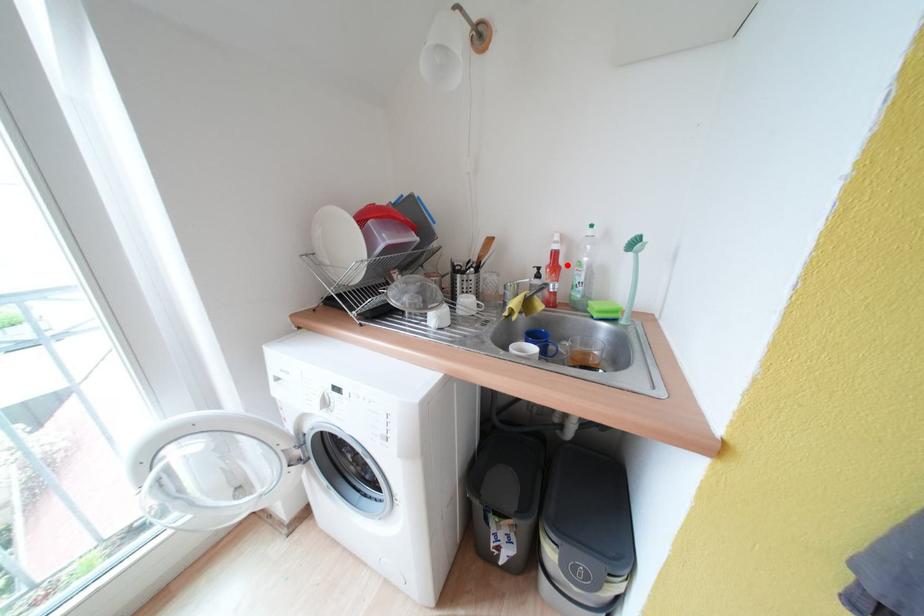
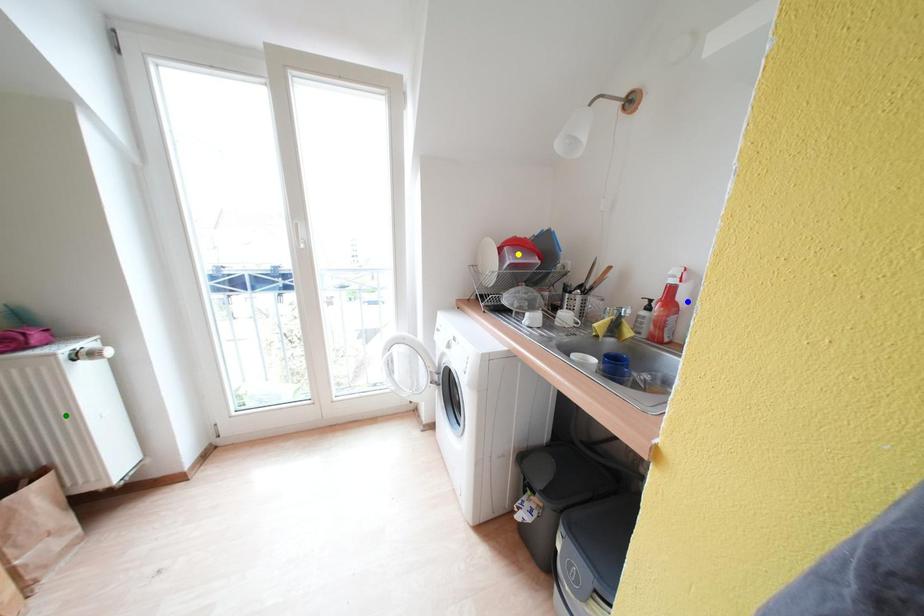
Question: I am providing you with two images of the same scene from different viewpoints. A red point is marked on the first image. You are given multiple points on the second image. In image 2, which mark is for the same physical point as the one in image 1?

Choices:
 (A) blue point
 (B) yellow point
 (C) green point

Answer: (A)